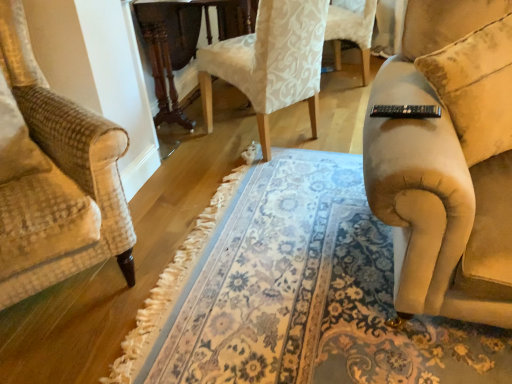
Question: Should I look upward or downward to see floral carpet at center?

Choices:
 (A) up
 (B) down

Answer: (B)

Question: Can you confirm if white damask fabric chair at center is shorter than beige fabric couch at right?

Choices:
 (A) yes
 (B) no

Answer: (B)

Question: Is white damask fabric chair at center far from beige fabric couch at right?

Choices:
 (A) no
 (B) yes

Answer: (A)

Question: Considering the relative positions of white damask fabric chair at center and beige fabric couch at right in the image provided, is white damask fabric chair at center to the right of beige fabric couch at right from the viewer's perspective?

Choices:
 (A) no
 (B) yes

Answer: (A)

Question: Is beige fabric couch at right completely or partially inside white damask fabric chair at center?

Choices:
 (A) no
 (B) yes

Answer: (A)

Question: Considering the relative sizes of white damask fabric chair at center and beige fabric couch at right in the image provided, is white damask fabric chair at center thinner than beige fabric couch at right?

Choices:
 (A) yes
 (B) no

Answer: (B)

Question: From the image's perspective, is white damask fabric chair at center on beige fabric couch at right?

Choices:
 (A) yes
 (B) no

Answer: (A)

Question: From a real-world perspective, is floral carpet at center physically below dark wood round table at center?

Choices:
 (A) yes
 (B) no

Answer: (A)

Question: Can you see floral carpet at center touching dark wood round table at center?

Choices:
 (A) yes
 (B) no

Answer: (B)

Question: Are floral carpet at center and dark wood round table at center far apart?

Choices:
 (A) no
 (B) yes

Answer: (B)

Question: Considering the relative sizes of floral carpet at center and dark wood round table at center in the image provided, is floral carpet at center shorter than dark wood round table at center?

Choices:
 (A) yes
 (B) no

Answer: (A)

Question: Is floral carpet at center oriented towards dark wood round table at center?

Choices:
 (A) no
 (B) yes

Answer: (A)

Question: Does floral carpet at center appear on the right side of dark wood round table at center?

Choices:
 (A) no
 (B) yes

Answer: (B)

Question: From a real-world perspective, is floral carpet at center located higher than beige fabric couch at right?

Choices:
 (A) yes
 (B) no

Answer: (B)